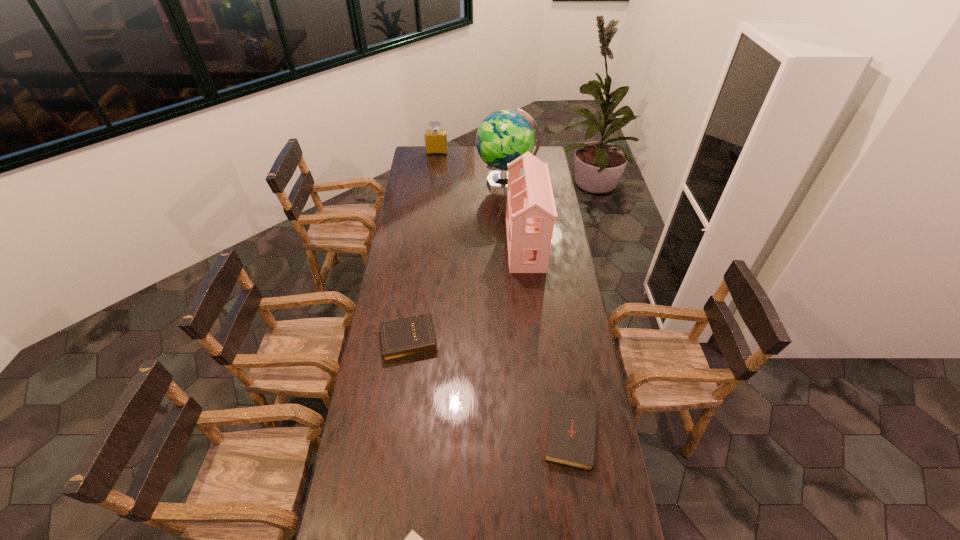
Identify the location of blank space located on the front-facing side of the third farthest object. This screenshot has width=960, height=540. (432, 245).

This screenshot has width=960, height=540. In order to click on vacant space located 0.250m on the front-facing side of the third farthest object in this screenshot , I will do `click(456, 245)`.

This screenshot has height=540, width=960. I want to click on vacant point located 0.060m on the front-facing side of the third farthest object, so click(494, 245).

Find the location of a particular element. vacant region located on the front-facing side of the farthest object is located at coordinates (433, 186).

In order to click on vacant area situated 0.100m on the front of the third nearest object in this screenshot , I will do `click(399, 386)`.

At what (x,y) coordinates should I click in order to perform the action: click on vacant area situated 0.270m on the back of the second shortest Bible. Please return your answer as a coordinate pair (x, y). Looking at the image, I should click on (557, 334).

Identify the location of object situated at the far edge. (435, 139).

Locate an element on the screen. Image resolution: width=960 pixels, height=540 pixels. perfume positioned at the left edge is located at coordinates (435, 139).

Image resolution: width=960 pixels, height=540 pixels. I want to click on Bible at the left edge, so click(403, 338).

Where is `globe positioned at the right edge`? globe positioned at the right edge is located at coordinates (504, 135).